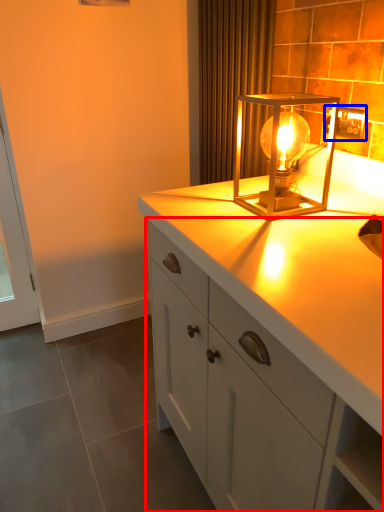
Question: Among these objects, which one is farthest to the camera, cabinetry (highlighted by a red box) or electric outlet (highlighted by a blue box)?

Choices:
 (A) cabinetry
 (B) electric outlet

Answer: (B)